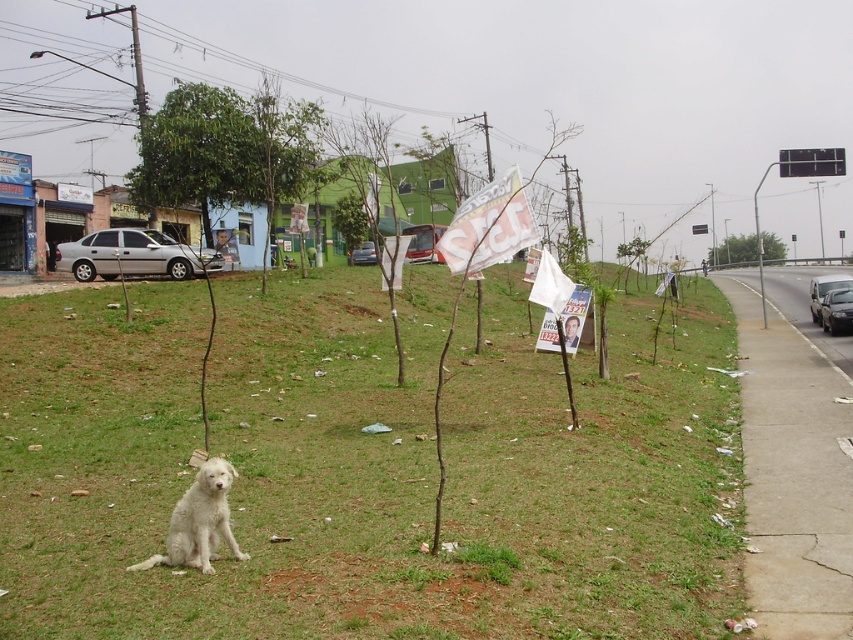
You are a photographer trying to capture a clear shot of the green grassy at lower left and the white fluffy dog at lower left. Since you want the dog to be the main focus, which object should you position closer to the camera?

The white fluffy dog at lower left should be positioned closer to the camera because the green grassy at lower left is taller, so placing the dog closer will ensure it remains the main focus without being obscured by the taller grass.

You are a photographer trying to capture the white fluffy dog at lower left and the green grassy at lower left in your shot. Based on their positions, which object is closer to the camera?

The white fluffy dog at lower left is closer to the camera because it is positioned at the lower left, while the green grassy area is also at the lower left but might be wider, indicating it could be further back or part of the background.